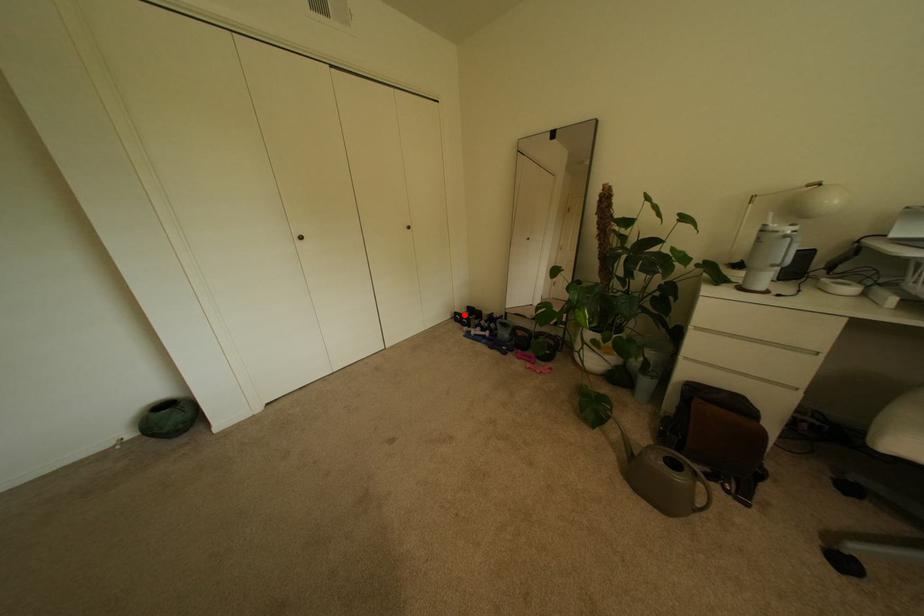
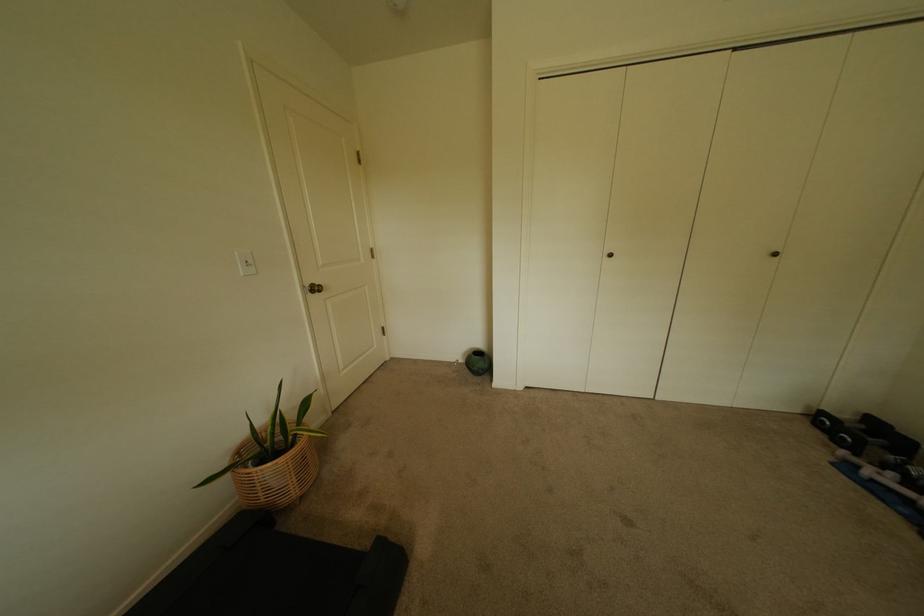
Question: I am providing you with two images of the same scene from different viewpoints. Given a red point in image1, look at the same physical point in image2. Is it:

Choices:
 (A) Closer to the viewpoint
 (B) Farther from the viewpoint

Answer: (B)